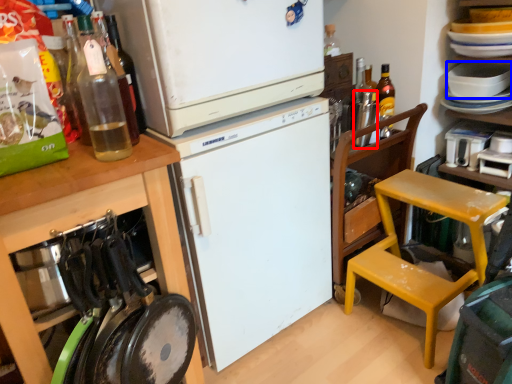
Question: Which point is closer to the camera, bottle (highlighted by a red box) or appliance (highlighted by a blue box)?

Choices:
 (A) bottle
 (B) appliance

Answer: (A)